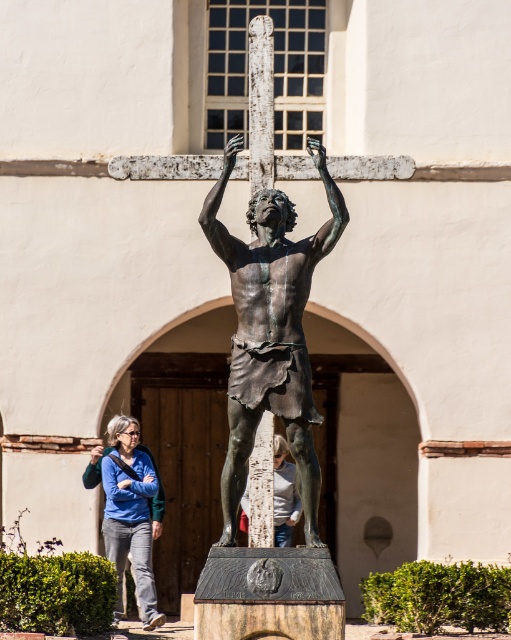
Which of these two, bronze statue at center or blue denim jeans at lower left, stands shorter?

With less height is blue denim jeans at lower left.

I want to click on bronze statue at center, so click(270, 330).

What are the coordinates of `bronze statue at center` in the screenshot? It's located at (270, 330).

Where is `bronze statue at center`? This screenshot has height=640, width=511. bronze statue at center is located at coordinates (270, 330).

Is point (343, 218) closer to viewer compared to point (278, 522)?

Yes, point (343, 218) is closer to viewer.

Is point (290, 211) closer to viewer compared to point (276, 518)?

Yes, it is.

Find the location of `bronze statue at center`. bronze statue at center is located at coordinates (270, 330).

This screenshot has height=640, width=511. What do you see at coordinates (128, 509) in the screenshot?
I see `blue denim jeans at lower left` at bounding box center [128, 509].

Between point (120, 449) and point (277, 477), which one is positioned behind?

Point (277, 477)

Locate an element on the screen. blue denim jeans at lower left is located at coordinates (128, 509).